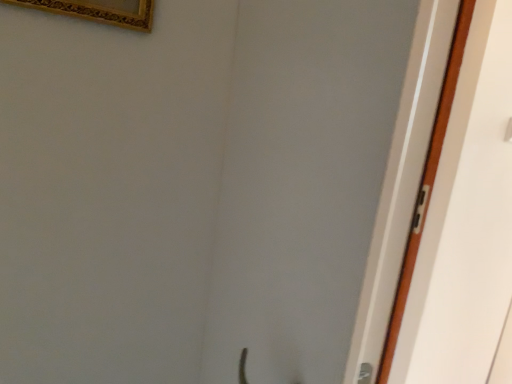
Question: Should I look upward or downward to see gold ornate picture frame at upper left?

Choices:
 (A) up
 (B) down

Answer: (A)